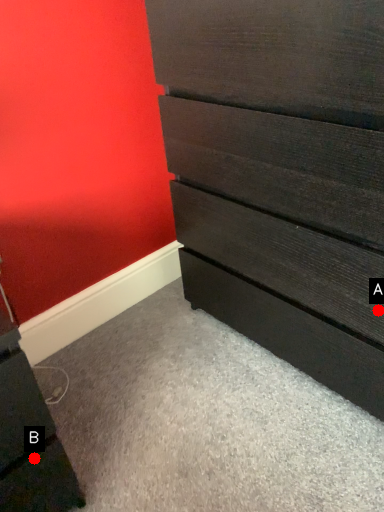
Question: Two points are circled on the image, labeled by A and B beside each circle. Which of the following is the closest to the observer?

Choices:
 (A) A is closer
 (B) B is closer

Answer: (B)